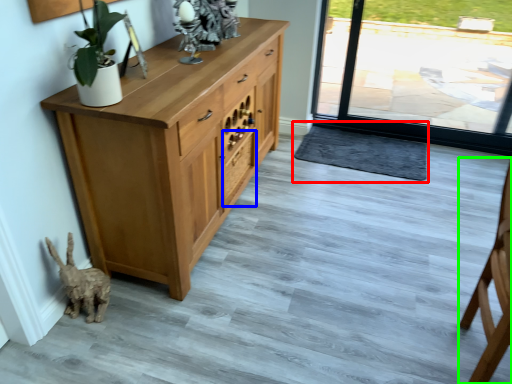
Question: Considering the real-world distances, which object is farthest from doormat (highlighted by a red box)? drawer (highlighted by a blue box) or chair (highlighted by a green box)?

Choices:
 (A) drawer
 (B) chair

Answer: (B)